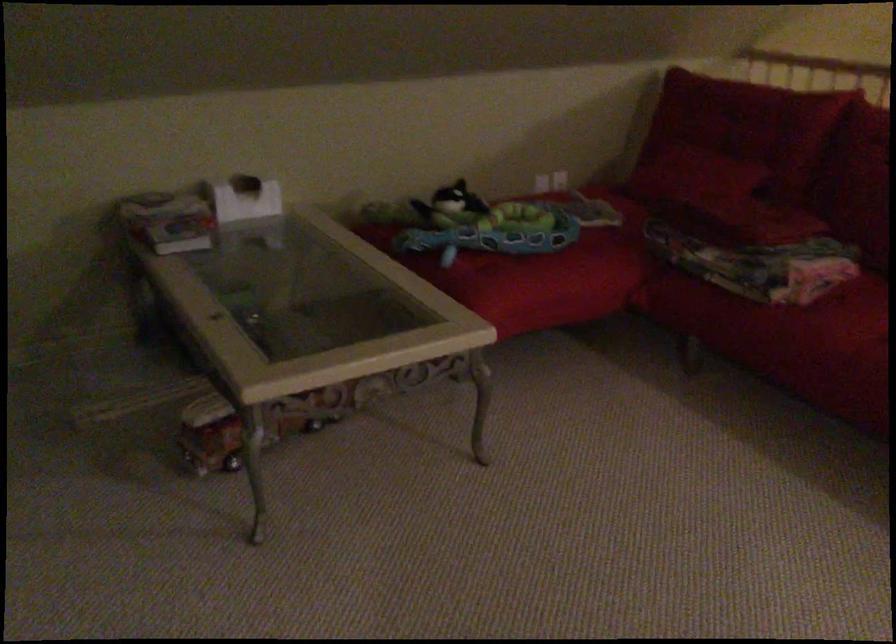
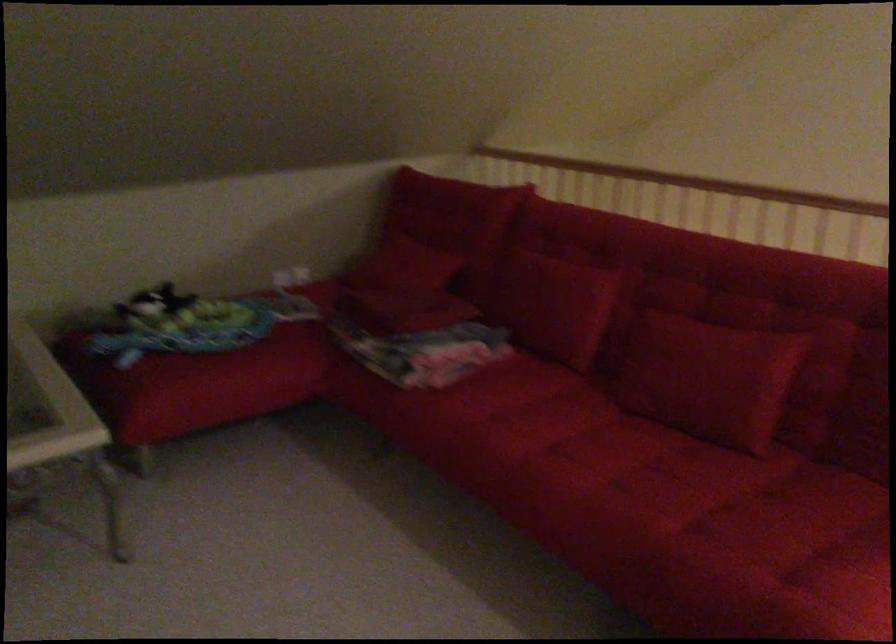
Question: How did the camera likely rotate?

Choices:
 (A) Left
 (B) Right
 (C) Up
 (D) Down

Answer: (C)